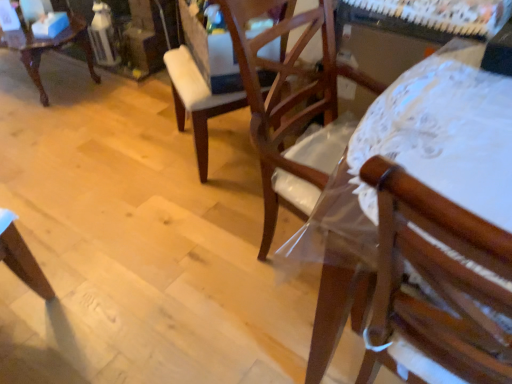
Question: In terms of width, does wooden chair at right, the third chair viewed from the back, look wider or thinner when compared to wooden chair at center, which is the 2th chair from back to front?

Choices:
 (A) wide
 (B) thin

Answer: (A)

Question: Is wooden chair at right, the third chair viewed from the back, situated inside wooden chair at center, the 2th chair positioned from the right, or outside?

Choices:
 (A) inside
 (B) outside

Answer: (B)

Question: Estimate the real-world distances between objects in this image. Which object is farther from the wooden chair at center, which is the 2th chair from back to front?

Choices:
 (A) matte white chair at upper left, which ranks as the 1th chair in back-to-front order
 (B) wooden chair at right, which ranks as the 1th chair in front-to-back order

Answer: (A)

Question: Which of these objects is positioned farthest from the wooden chair at right, which is counted as the 1th chair, starting from the right?

Choices:
 (A) wooden chair at center, arranged as the second chair when viewed from the left
 (B) matte white chair at upper left, which ranks as the 1th chair in back-to-front order

Answer: (B)